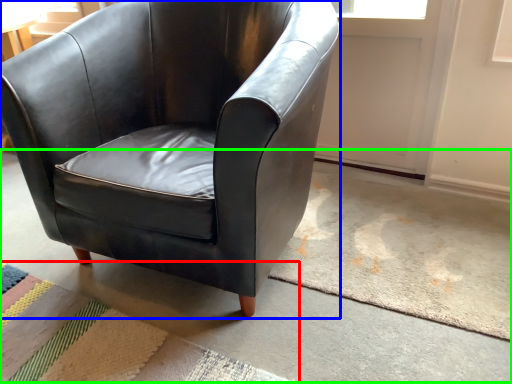
Question: Which object is positioned farthest from mat (highlighted by a red box)? Select from chair (highlighted by a blue box) and concrete (highlighted by a green box).

Choices:
 (A) chair
 (B) concrete

Answer: (A)